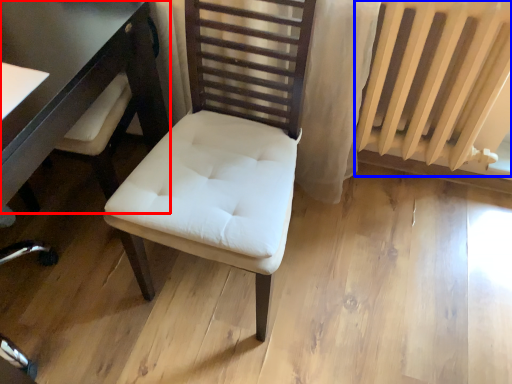
Question: Which object appears farthest to the camera in this image, table (highlighted by a red box) or radiator (highlighted by a blue box)?

Choices:
 (A) table
 (B) radiator

Answer: (B)